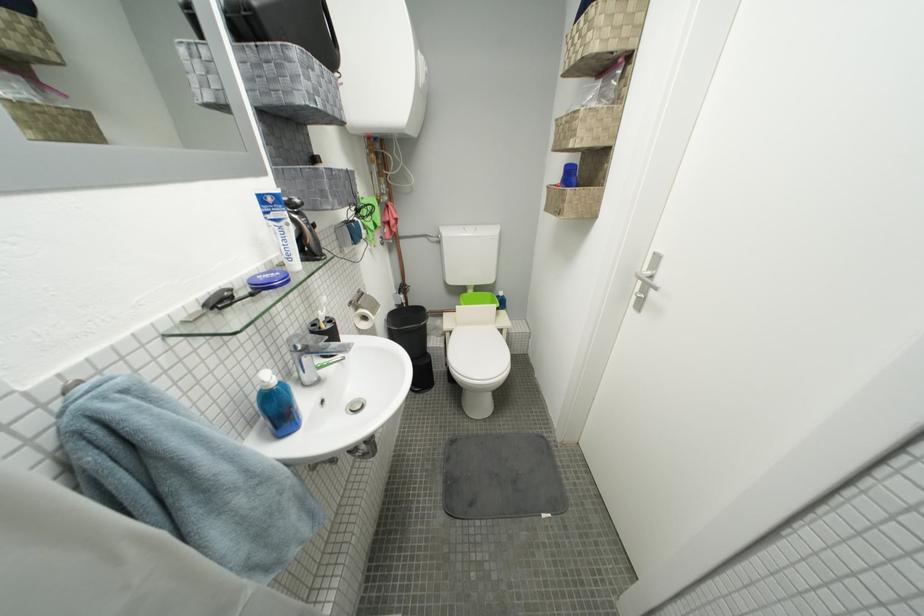
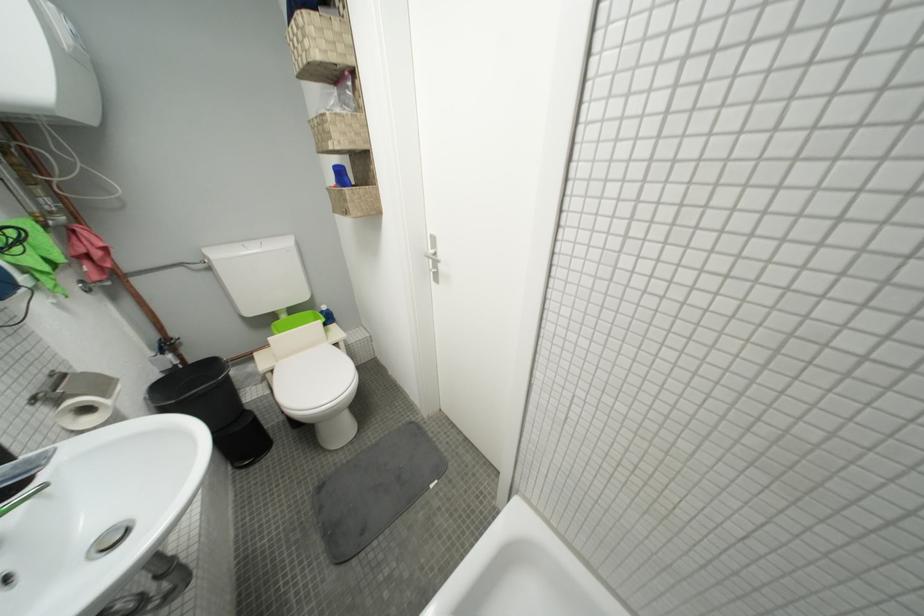
Find the pixel in the second image that matches pixel 360 406 in the first image.

(107, 541)